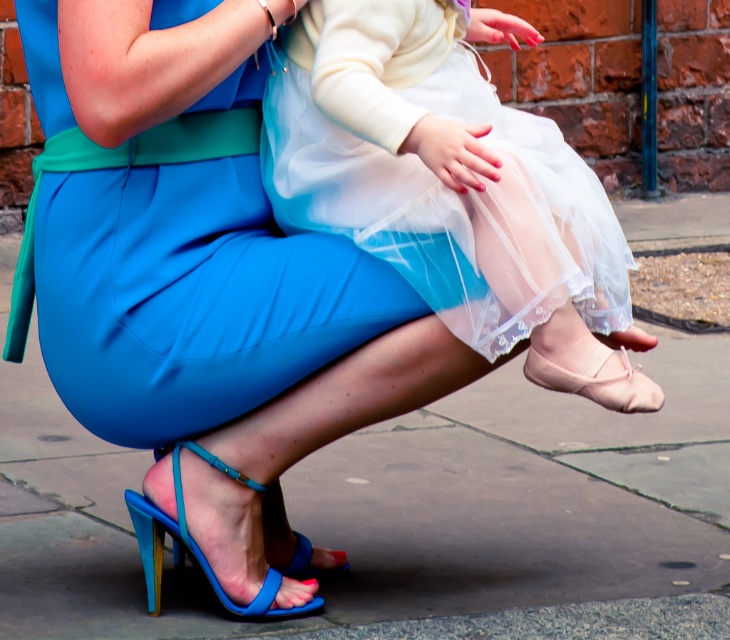
You are a photographer trying to capture a close shot of the blue glossy sandal at lower left and the pink satin ballet shoe at lower center. You need to ensure both are in focus. If your camera has a depth of field that can cover 5 feet, will both items be in focus?

The blue glossy sandal at lower left is 4.50 feet away from the pink satin ballet shoe at lower center. Since the distance between them is within the 5 feet depth of field, both items will be in focus.

Looking at this image, you are a photographer trying to capture a clear shot of the white sheer dress at center and the pink satin ballet shoe at lower center. Which object should you focus on first to ensure both are in focus?

The white sheer dress at center is in front of the pink satin ballet shoe at lower center, so you should focus on the white sheer dress at center first to ensure both are in focus.

You are a photographer trying to capture the child in the scene. Since the white sheer dress at center and the pink satin ballet shoe at lower center are in the frame, which object should you focus on to ensure the child is centered in your photo?

The white sheer dress at center is located above the pink satin ballet shoe at lower center, so focusing on the white sheer dress at center will ensure the child is centered in the photo.